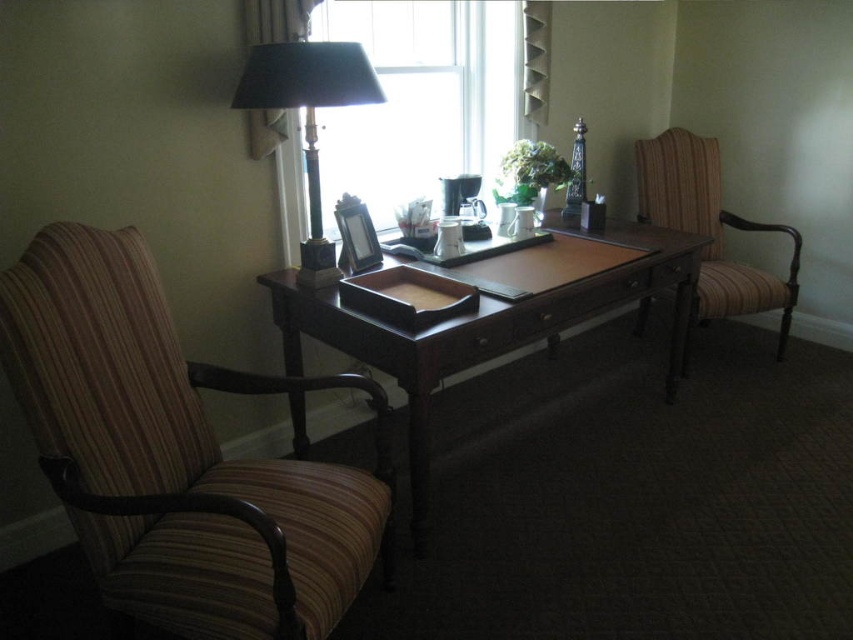
Question: Which of the following is the farthest from the observer?

Choices:
 (A) (289, 202)
 (B) (285, 83)
 (C) (308, 305)
 (D) (770, 300)

Answer: (D)

Question: Does dark wood desk at center have a lesser width compared to black marble lamp at upper left?

Choices:
 (A) no
 (B) yes

Answer: (A)

Question: Does dark wood desk at center appear under striped fabric armchair at right?

Choices:
 (A) no
 (B) yes

Answer: (B)

Question: Among these objects, which one is nearest to the camera?

Choices:
 (A) transparent glass window at upper center
 (B) striped fabric armchair at right
 (C) striped fabric swivel chair at left

Answer: (C)

Question: Among these objects, which one is nearest to the camera?

Choices:
 (A) dark wood desk at center
 (B) striped fabric armchair at right
 (C) transparent glass window at upper center
 (D) striped fabric swivel chair at left

Answer: (D)

Question: Where is striped fabric swivel chair at left located in relation to satin beige curtain at upper left in the image?

Choices:
 (A) below
 (B) above

Answer: (A)